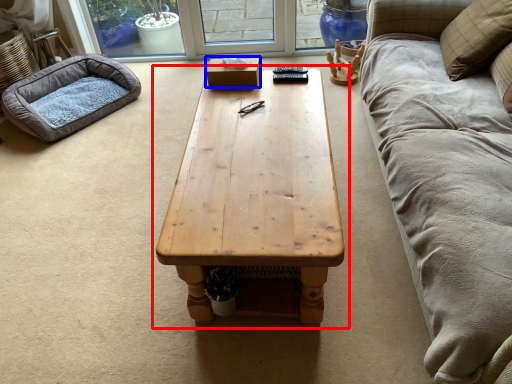
Question: Among these objects, which one is nearest to the camera, coffee table (highlighted by a red box) or box (highlighted by a blue box)?

Choices:
 (A) coffee table
 (B) box

Answer: (A)